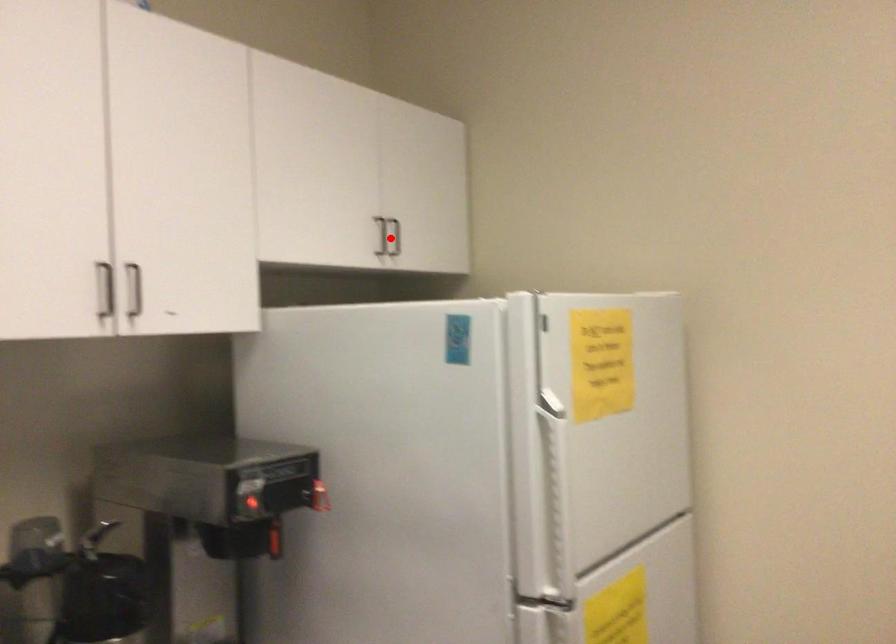
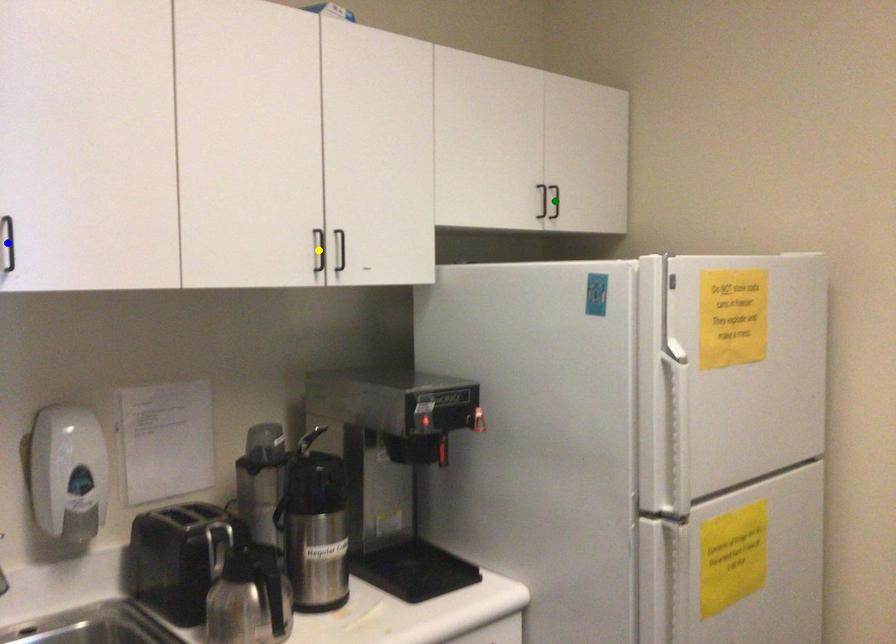
Question: I am providing you with two images of the same scene from different viewpoints. A red point is marked on the first image. You are given multiple points on the second image. Can you choose the point in image 2 that corresponds to the point in image 1?

Choices:
 (A) yellow point
 (B) blue point
 (C) green point

Answer: (C)